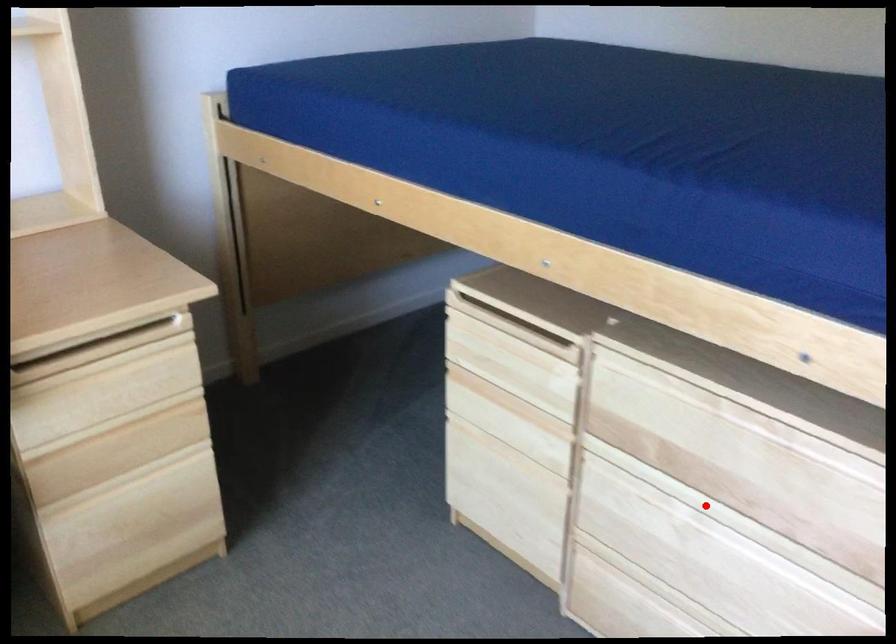
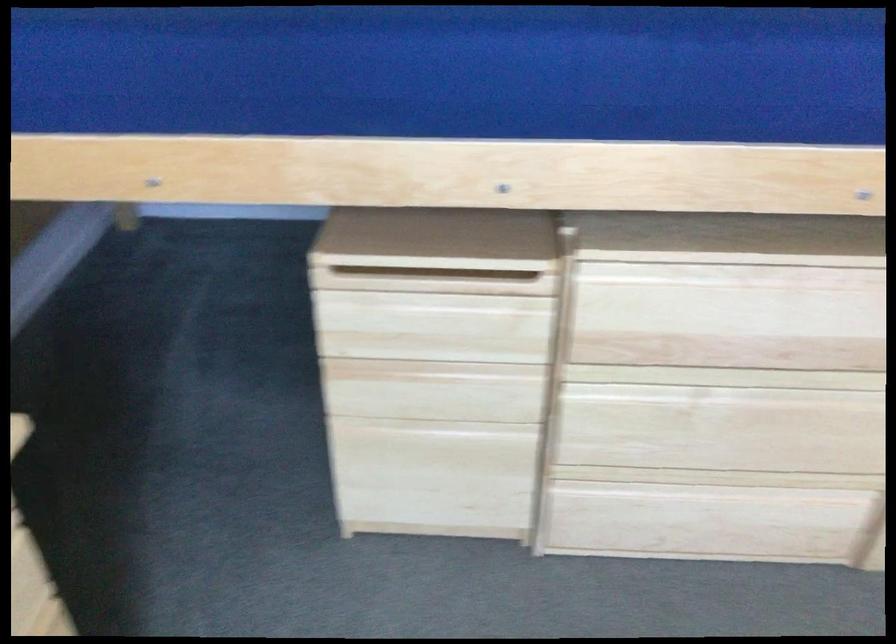
Find the pixel in the second image that matches the highlighted location in the first image.

(728, 377)